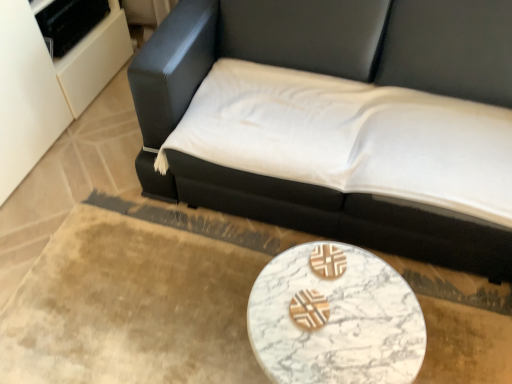
The image size is (512, 384). Describe the element at coordinates (326, 48) in the screenshot. I see `black leather studio couch at upper center` at that location.

Where is `black leather studio couch at upper center`? black leather studio couch at upper center is located at coordinates (326, 48).

Image resolution: width=512 pixels, height=384 pixels. I want to click on white marble table at lower center, so coord(335,318).

Image resolution: width=512 pixels, height=384 pixels. What do you see at coordinates (335, 318) in the screenshot?
I see `white marble table at lower center` at bounding box center [335, 318].

The width and height of the screenshot is (512, 384). In order to click on black leather studio couch at upper center in this screenshot , I will do `click(326, 48)`.

Which object is positioned more to the right, white marble table at lower center or black leather studio couch at upper center?

From the viewer's perspective, black leather studio couch at upper center appears more on the right side.

Is white marble table at lower center in front of black leather studio couch at upper center?

That is False.

Is point (415, 338) positioned before point (464, 84)?

That is True.

From the image's perspective, which one is positioned higher, white marble table at lower center or black leather studio couch at upper center?

From the image's view, black leather studio couch at upper center is above.

From a real-world perspective, which is physically above, white marble table at lower center or black leather studio couch at upper center?

From a 3D spatial view, black leather studio couch at upper center is above.

Does white marble table at lower center have a lesser width compared to black leather studio couch at upper center?

Indeed, white marble table at lower center has a lesser width compared to black leather studio couch at upper center.

In terms of height, does white marble table at lower center look taller or shorter compared to black leather studio couch at upper center?

Considering their sizes, white marble table at lower center has less height than black leather studio couch at upper center.

Is white marble table at lower center smaller than black leather studio couch at upper center?

Indeed, white marble table at lower center has a smaller size compared to black leather studio couch at upper center.

Is white marble table at lower center located outside black leather studio couch at upper center?

white marble table at lower center is positioned outside black leather studio couch at upper center.

Consider the image. Would you consider white marble table at lower center to be distant from black leather studio couch at upper center?

white marble table at lower center is near black leather studio couch at upper center, not far away.

Is white marble table at lower center looking in the opposite direction of black leather studio couch at upper center?

Yes, white marble table at lower center is positioned with its back facing black leather studio couch at upper center.

How many degrees apart are the facing directions of white marble table at lower center and black leather studio couch at upper center?

The facing directions of white marble table at lower center and black leather studio couch at upper center are 6.97e-05 degrees apart.

Find the location of a particular element. The height and width of the screenshot is (384, 512). studio couch on the right of white marble table at lower center is located at coordinates point(326,48).

Visually, is black leather studio couch at upper center positioned to the left or to the right of white marble table at lower center?

Based on their positions, black leather studio couch at upper center is located to the right of white marble table at lower center.

Which object is closer to the camera, black leather studio couch at upper center or white marble table at lower center?

black leather studio couch at upper center is closer to the camera.

Does point (333, 222) lie behind point (303, 271)?

Yes, point (333, 222) is farther from viewer.

From the image's perspective, is black leather studio couch at upper center positioned above or below white marble table at lower center?

black leather studio couch at upper center is above white marble table at lower center.

From a real-world perspective, who is located higher, black leather studio couch at upper center or white marble table at lower center?

black leather studio couch at upper center.

Between black leather studio couch at upper center and white marble table at lower center, which one has larger width?

Wider between the two is black leather studio couch at upper center.

Does black leather studio couch at upper center have a lesser height compared to white marble table at lower center?

No.

Between black leather studio couch at upper center and white marble table at lower center, which one has smaller size?

With smaller size is white marble table at lower center.

Is black leather studio couch at upper center inside the boundaries of white marble table at lower center, or outside?

The correct answer is: outside.

Is black leather studio couch at upper center far away from white marble table at lower center?

black leather studio couch at upper center is near white marble table at lower center, not far away.

Is black leather studio couch at upper center looking in the opposite direction of white marble table at lower center?

No, white marble table at lower center is not at the back of black leather studio couch at upper center.

You are a GUI agent. You are given a task and a screenshot of the screen. Output one action in this format:
    pyautogui.click(x=<x>, y=<y>)
    Task: Click on the table below the black leather studio couch at upper center (from the image's perspective)
    The width and height of the screenshot is (512, 384).
    Given the screenshot: What is the action you would take?
    pyautogui.click(x=335, y=318)

You are a GUI agent. You are given a task and a screenshot of the screen. Output one action in this format:
    pyautogui.click(x=<x>, y=<y>)
    Task: Click on the table behind the black leather studio couch at upper center
    The width and height of the screenshot is (512, 384).
    Given the screenshot: What is the action you would take?
    (335, 318)

This screenshot has height=384, width=512. Find the location of `studio couch above the white marble table at lower center (from the image's perspective)`. studio couch above the white marble table at lower center (from the image's perspective) is located at coordinates (326, 48).